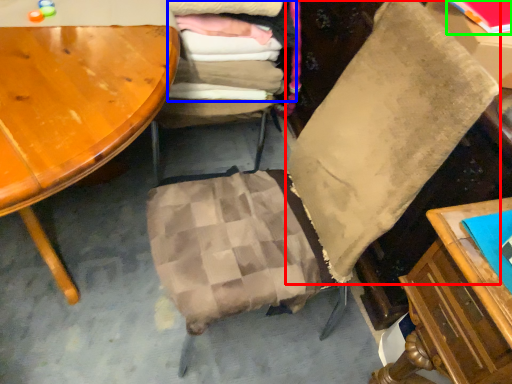
Question: Which object is the farthest from pillow (highlighted by a red box)? Choose among these: laundry (highlighted by a blue box) or book (highlighted by a green box).

Choices:
 (A) laundry
 (B) book

Answer: (A)